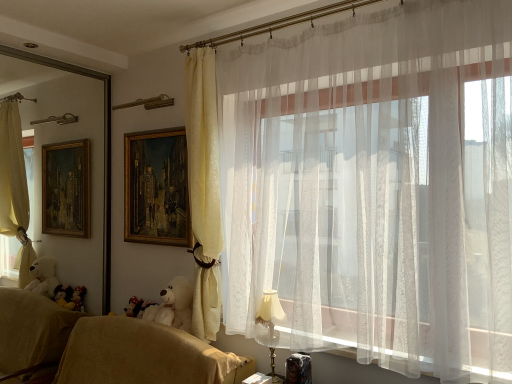
Question: From the image's perspective, is beige fabric couch at lower left located above or below gold wooden picture frame at upper center?

Choices:
 (A) below
 (B) above

Answer: (A)

Question: Is beige fabric couch at lower left wider or thinner than gold wooden picture frame at upper center?

Choices:
 (A) wide
 (B) thin

Answer: (A)

Question: Which object is positioned farthest from the white sheer curtain at upper right, the 2th curtain from the left?

Choices:
 (A) white plush toy at lower center
 (B) gold wooden picture frame at upper center
 (C) matte gold table lamp at lower right
 (D) matte yellow curtain at center, which is counted as the second curtain, starting from the right
 (E) beige fabric couch at lower left

Answer: (A)

Question: Estimate the real-world distances between objects in this image. Which object is closer to the matte gold table lamp at lower right?

Choices:
 (A) gold wooden picture frame at upper center
 (B) white sheer curtain at upper right, the 2th curtain from the left
 (C) white plush toy at lower center
 (D) white plush bear at lower left
 (E) beige fabric couch at lower left

Answer: (D)